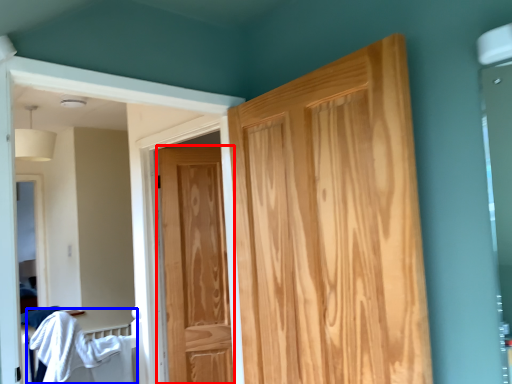
Question: Which object is further to the camera taking this photo, door (highlighted by a red box) or bed (highlighted by a blue box)?

Choices:
 (A) door
 (B) bed

Answer: (A)